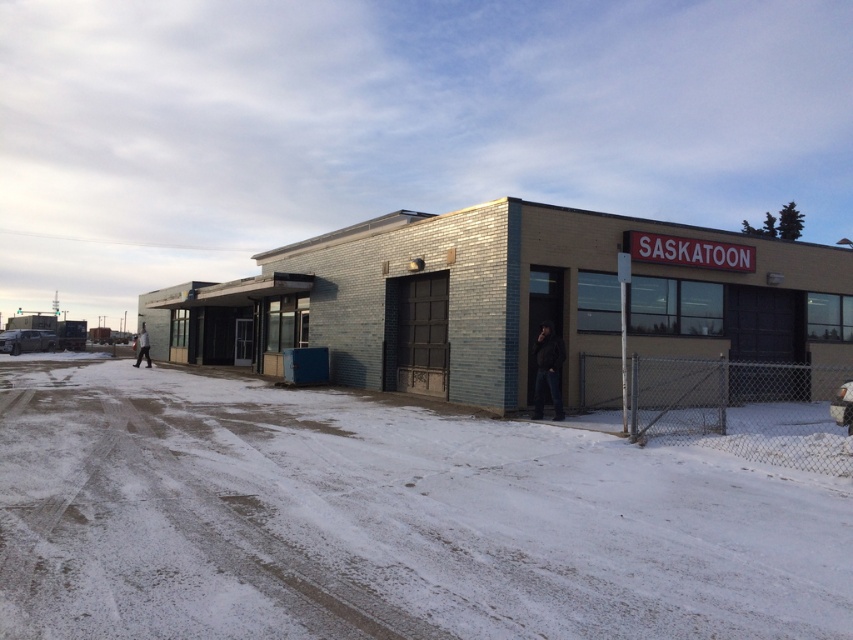
You are standing at the point labeled point (383, 520) in the image. What is the material you are standing on?

The point labeled point (383, 520) indicates white powdery snow at lower center, so you are standing on snow.

You are standing in front of the commercial building and want to place a small potted plant exactly at the location marked by the white powdery snow at lower center. According to the image, what are the coordinates where you should place it?

The coordinates for the white powdery snow at lower center are at point (383,520), so you should place the potted plant there.

You are standing in front of the commercial building and want to take a photo. There are two points marked on the building, one at point coordinates point (229,580) and another at point coordinates point (554,378). Which point will appear larger in your photo?

Point (229,580) is closer to the camera than point (554,378), so it will appear larger in the photo.